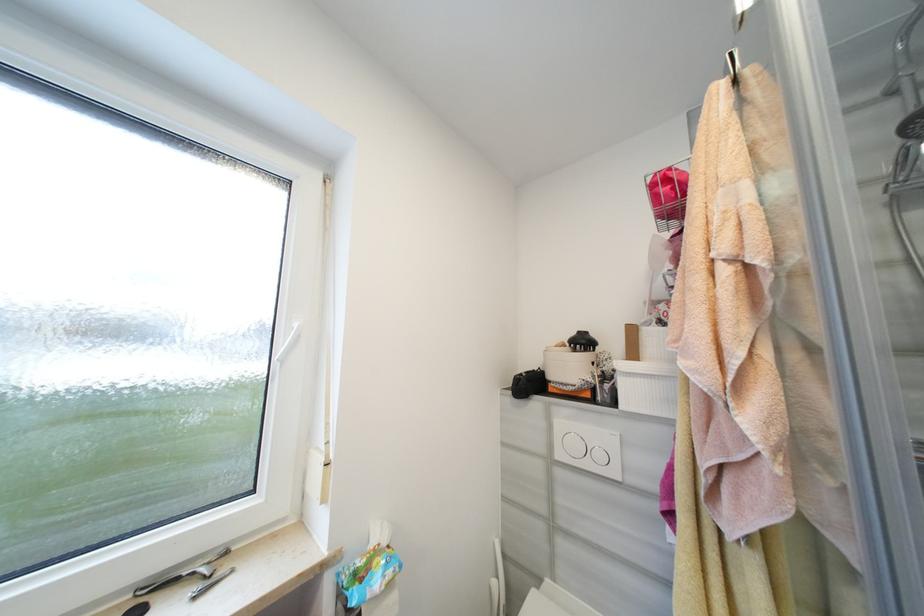
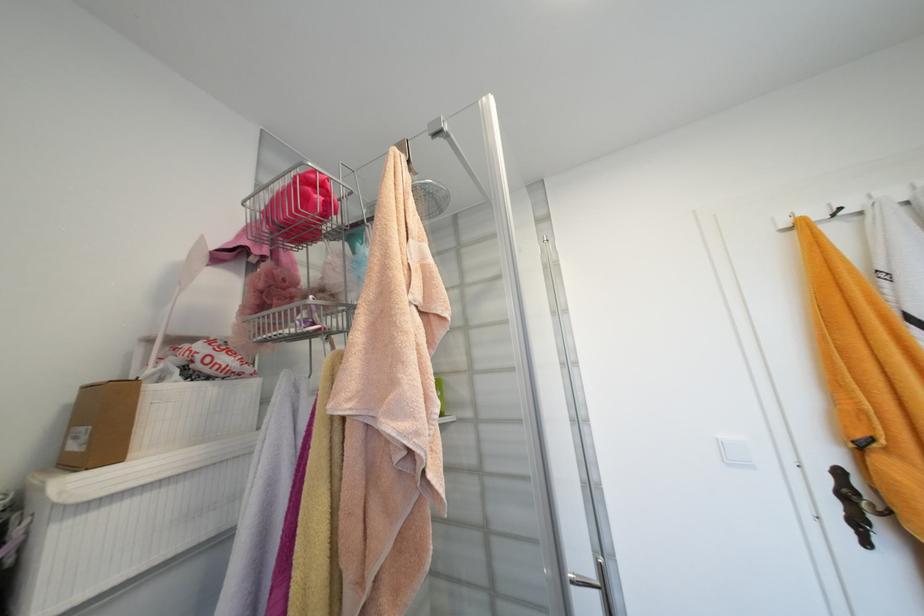
Where in the second image is the point corresponding to (650,305) from the first image?

(154, 342)